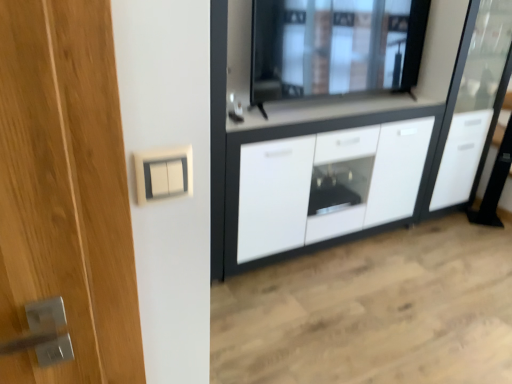
Question: Can you confirm if white glossy cabinet at right is taller than white plastic switch at upper center?

Choices:
 (A) no
 (B) yes

Answer: (B)

Question: From a real-world perspective, is white glossy cabinet at right on white plastic switch at upper center?

Choices:
 (A) no
 (B) yes

Answer: (A)

Question: Is white glossy cabinet at right far away from white plastic switch at upper center?

Choices:
 (A) no
 (B) yes

Answer: (B)

Question: Is white glossy cabinet at right shorter than white plastic switch at upper center?

Choices:
 (A) no
 (B) yes

Answer: (A)

Question: Does white glossy cabinet at right turn towards white plastic switch at upper center?

Choices:
 (A) no
 (B) yes

Answer: (A)

Question: From the image's perspective, is white glossy cabinet at right below white plastic switch at upper center?

Choices:
 (A) no
 (B) yes

Answer: (A)

Question: Is transparent glass window at upper center behind white plastic switch at upper center?

Choices:
 (A) no
 (B) yes

Answer: (B)

Question: From the image's perspective, would you say transparent glass window at upper center is positioned over white plastic switch at upper center?

Choices:
 (A) no
 (B) yes

Answer: (B)

Question: Is transparent glass window at upper center oriented towards white plastic switch at upper center?

Choices:
 (A) yes
 (B) no

Answer: (B)

Question: Is the surface of transparent glass window at upper center in direct contact with white plastic switch at upper center?

Choices:
 (A) no
 (B) yes

Answer: (A)

Question: From a real-world perspective, does transparent glass window at upper center stand above white plastic switch at upper center?

Choices:
 (A) no
 (B) yes

Answer: (A)

Question: Does transparent glass window at upper center have a smaller size compared to white plastic switch at upper center?

Choices:
 (A) no
 (B) yes

Answer: (A)

Question: From a real-world perspective, is white glossy cabinet at center on white glossy cabinet at right?

Choices:
 (A) yes
 (B) no

Answer: (B)